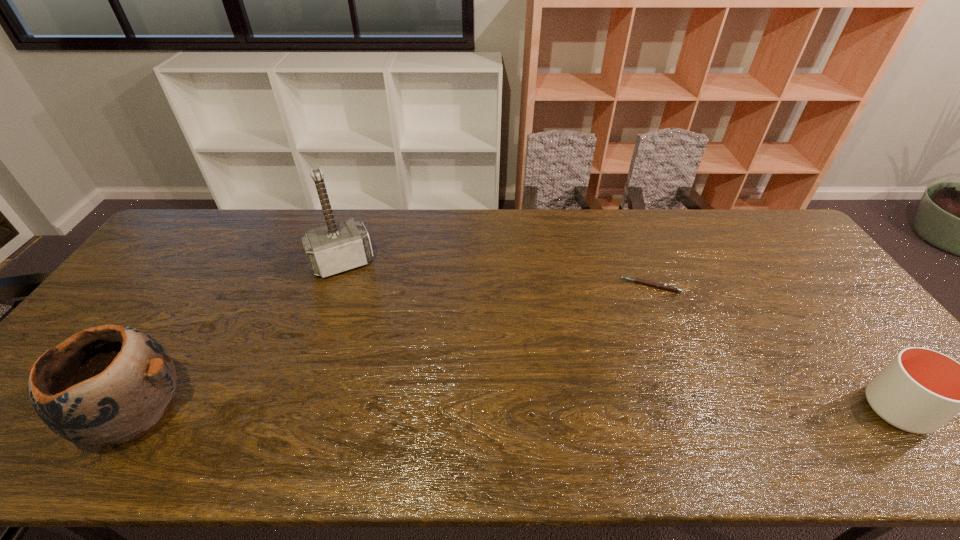
Where is `vacant space located 0.240m for striking with the head of the hammer`? This screenshot has height=540, width=960. vacant space located 0.240m for striking with the head of the hammer is located at coordinates click(x=375, y=334).

What are the coordinates of `free space located for striking with the head of the hammer` in the screenshot? It's located at (396, 378).

At what (x,y) coordinates should I click in order to perform the action: click on free space located for striking with the head of the hammer. Please return your answer as a coordinate pair (x, y). The image size is (960, 540). Looking at the image, I should click on (373, 328).

Locate an element on the screen. blank space located 0.380m at the nib of the third object from left to right is located at coordinates (534, 352).

You are a GUI agent. You are given a task and a screenshot of the screen. Output one action in this format:
    pyautogui.click(x=<x>, y=<y>)
    Task: Click on the vacant space situated 0.060m at the nib of the third object from left to right
    The height and width of the screenshot is (540, 960).
    Given the screenshot: What is the action you would take?
    pyautogui.click(x=615, y=299)

This screenshot has width=960, height=540. Identify the location of vacant space located 0.130m at the nib of the third object from left to right. (599, 310).

The width and height of the screenshot is (960, 540). I want to click on object at the far edge, so click(338, 247).

This screenshot has height=540, width=960. What are the coordinates of `pottery present at the near edge` in the screenshot? It's located at (112, 383).

Locate an element on the screen. This screenshot has width=960, height=540. cup present at the near edge is located at coordinates pos(920,390).

This screenshot has height=540, width=960. In order to click on object located at the left edge in this screenshot , I will do `click(112, 383)`.